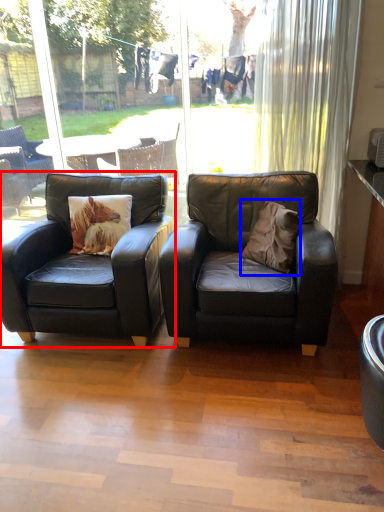
Question: Which object is further to the camera taking this photo, chair (highlighted by a red box) or throw pillow (highlighted by a blue box)?

Choices:
 (A) chair
 (B) throw pillow

Answer: (B)